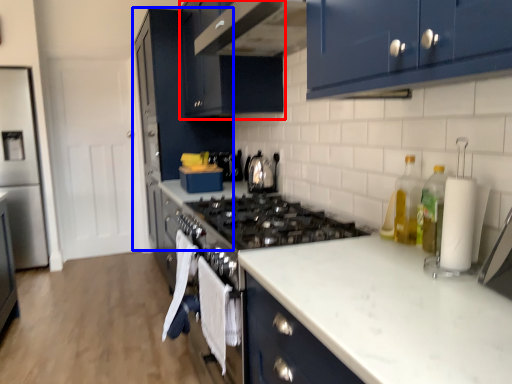
Question: Which object is closer to the camera taking this photo, cabinetry (highlighted by a red box) or cabinetry (highlighted by a blue box)?

Choices:
 (A) cabinetry
 (B) cabinetry

Answer: (A)